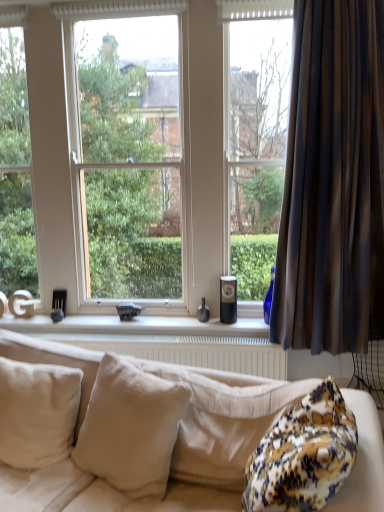
Question: Is brown striped curtain at right bigger than beige fabric couch at lower center?

Choices:
 (A) yes
 (B) no

Answer: (B)

Question: Is brown striped curtain at right oriented away from beige fabric couch at lower center?

Choices:
 (A) yes
 (B) no

Answer: (B)

Question: From a real-world perspective, does brown striped curtain at right sit lower than beige fabric couch at lower center?

Choices:
 (A) yes
 (B) no

Answer: (B)

Question: Does brown striped curtain at right appear on the left side of beige fabric couch at lower center?

Choices:
 (A) no
 (B) yes

Answer: (A)

Question: From a real-world perspective, does brown striped curtain at right stand above beige fabric couch at lower center?

Choices:
 (A) no
 (B) yes

Answer: (B)

Question: Is brown striped curtain at right positioned before beige fabric couch at lower center?

Choices:
 (A) no
 (B) yes

Answer: (A)

Question: Can you confirm if brown striped curtain at right is thinner than beige fabric pillow at center, acting as the 2th pillow starting from the left?

Choices:
 (A) no
 (B) yes

Answer: (B)

Question: From a real-world perspective, is brown striped curtain at right located beneath beige fabric pillow at center, acting as the 2th pillow starting from the left?

Choices:
 (A) yes
 (B) no

Answer: (B)

Question: Does brown striped curtain at right turn towards beige fabric pillow at center, acting as the 2th pillow starting from the left?

Choices:
 (A) yes
 (B) no

Answer: (B)

Question: Is brown striped curtain at right shorter than beige fabric pillow at center, acting as the 2th pillow starting from the left?

Choices:
 (A) yes
 (B) no

Answer: (B)

Question: Is brown striped curtain at right positioned with its back to beige fabric pillow at center, acting as the 2th pillow starting from the left?

Choices:
 (A) no
 (B) yes

Answer: (A)

Question: From a real-world perspective, is brown striped curtain at right located higher than beige fabric pillow at center, acting as the 2th pillow starting from the left?

Choices:
 (A) no
 (B) yes

Answer: (B)

Question: Can you confirm if white textured radiator at lower center is taller than white matte window sill at center?

Choices:
 (A) yes
 (B) no

Answer: (A)